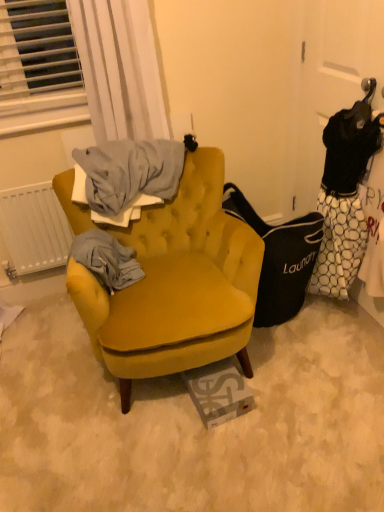
Question: Does velvet mustard armchair at center come in front of white dotted fabric at right?

Choices:
 (A) yes
 (B) no

Answer: (A)

Question: Can you confirm if velvet mustard armchair at center is bigger than white dotted fabric at right?

Choices:
 (A) yes
 (B) no

Answer: (A)

Question: Is velvet mustard armchair at center wider than white dotted fabric at right?

Choices:
 (A) no
 (B) yes

Answer: (B)

Question: Does velvet mustard armchair at center turn towards white dotted fabric at right?

Choices:
 (A) yes
 (B) no

Answer: (B)

Question: Can you confirm if velvet mustard armchair at center is smaller than white dotted fabric at right?

Choices:
 (A) yes
 (B) no

Answer: (B)

Question: Does velvet mustard armchair at center appear on the right side of white dotted fabric at right?

Choices:
 (A) yes
 (B) no

Answer: (B)

Question: Is the depth of velvet mustard armchair at center greater than that of white sheer curtain at upper left?

Choices:
 (A) no
 (B) yes

Answer: (A)

Question: From a real-world perspective, is velvet mustard armchair at center below white sheer curtain at upper left?

Choices:
 (A) yes
 (B) no

Answer: (A)

Question: From the image's perspective, is velvet mustard armchair at center located above white sheer curtain at upper left?

Choices:
 (A) no
 (B) yes

Answer: (A)

Question: Can you confirm if velvet mustard armchair at center is smaller than white sheer curtain at upper left?

Choices:
 (A) no
 (B) yes

Answer: (A)

Question: Considering the relative positions of velvet mustard armchair at center and white sheer curtain at upper left in the image provided, is velvet mustard armchair at center to the right of white sheer curtain at upper left from the viewer's perspective?

Choices:
 (A) yes
 (B) no

Answer: (A)

Question: Is velvet mustard armchair at center closer to camera compared to white sheer curtain at upper left?

Choices:
 (A) no
 (B) yes

Answer: (B)

Question: Does white sheer curtain at upper left appear on the left side of white matte radiator at left?

Choices:
 (A) no
 (B) yes

Answer: (A)